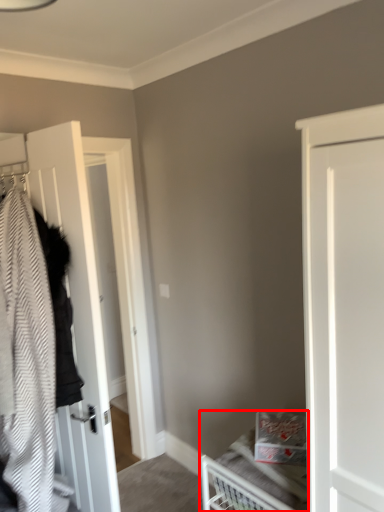
Question: From the image's perspective, where is bed (annotated by the red box) located in relation to door in the image?

Choices:
 (A) below
 (B) above

Answer: (A)